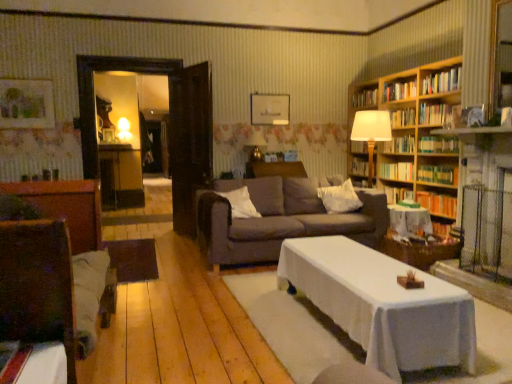
Question: From the image's perspective, is white soft pillow at center, placed as the second pillow when sorted from right to left, on hardcover book at upper right, the seventh book positioned from the bottom?

Choices:
 (A) yes
 (B) no

Answer: (B)

Question: Does white soft pillow at center, placed as the second pillow when sorted from right to left, have a larger size compared to hardcover book at upper right, the 5th book viewed from the top?

Choices:
 (A) yes
 (B) no

Answer: (A)

Question: Can hardcover book at upper right, the 5th book viewed from the top, be found inside white soft pillow at center, marked as the 1th pillow in a left-to-right arrangement?

Choices:
 (A) no
 (B) yes

Answer: (A)

Question: Does white soft pillow at center, placed as the second pillow when sorted from right to left, appear on the right side of hardcover book at upper right, the 5th book viewed from the top?

Choices:
 (A) no
 (B) yes

Answer: (A)

Question: Is white soft pillow at center, placed as the second pillow when sorted from right to left, positioned in front of hardcover book at upper right, the seventh book positioned from the bottom?

Choices:
 (A) yes
 (B) no

Answer: (A)

Question: From their relative heights in the image, would you say dark brown fabric couch at center is taller or shorter than white soft pillow at center, the 1th pillow from the right?

Choices:
 (A) tall
 (B) short

Answer: (A)

Question: From a real-world perspective, is dark brown fabric couch at center physically located above or below white soft pillow at center, the second pillow viewed from the left?

Choices:
 (A) above
 (B) below

Answer: (B)

Question: Does point (214, 253) appear closer or farther from the camera than point (356, 206)?

Choices:
 (A) closer
 (B) farther

Answer: (A)

Question: From the image's perspective, is dark brown fabric couch at center located above or below white soft pillow at center, the 1th pillow from the right?

Choices:
 (A) above
 (B) below

Answer: (B)

Question: Considering the positions of white soft pillow at center, marked as the 1th pillow in a left-to-right arrangement, and matte yellow lampshade at upper left, the 2th lamp from the bottom, in the image, is white soft pillow at center, marked as the 1th pillow in a left-to-right arrangement, bigger or smaller than matte yellow lampshade at upper left, the 2th lamp from the bottom,?

Choices:
 (A) small
 (B) big

Answer: (B)

Question: In the image, is white soft pillow at center, marked as the 1th pillow in a left-to-right arrangement, on the left side or the right side of matte yellow lampshade at upper left, placed as the second lamp when sorted from front to back?

Choices:
 (A) right
 (B) left

Answer: (A)

Question: Is point (239, 215) closer or farther from the camera than point (117, 129)?

Choices:
 (A) closer
 (B) farther

Answer: (A)

Question: From a real-world perspective, is white soft pillow at center, placed as the second pillow when sorted from right to left, physically located above or below matte yellow lampshade at upper left, positioned as the 1th lamp in back-to-front order?

Choices:
 (A) above
 (B) below

Answer: (B)

Question: Looking at their shapes, would you say white soft pillow at center, placed as the second pillow when sorted from right to left, is wider or thinner than hardcover book at upper right, the seventh book positioned from the bottom?

Choices:
 (A) thin
 (B) wide

Answer: (B)

Question: Would you say white soft pillow at center, placed as the second pillow when sorted from right to left, is to the left or to the right of hardcover book at upper right, the 5th book viewed from the top, in the picture?

Choices:
 (A) left
 (B) right

Answer: (A)